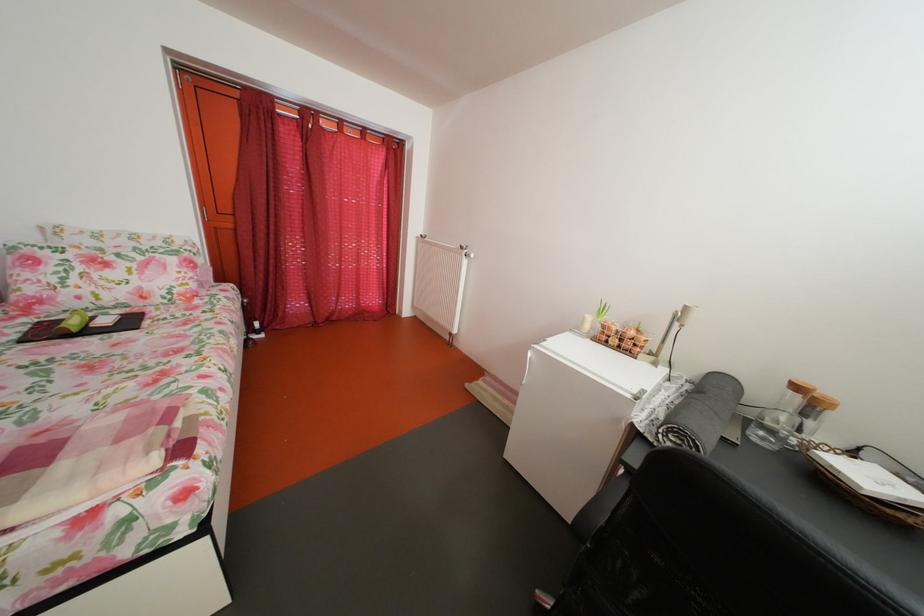
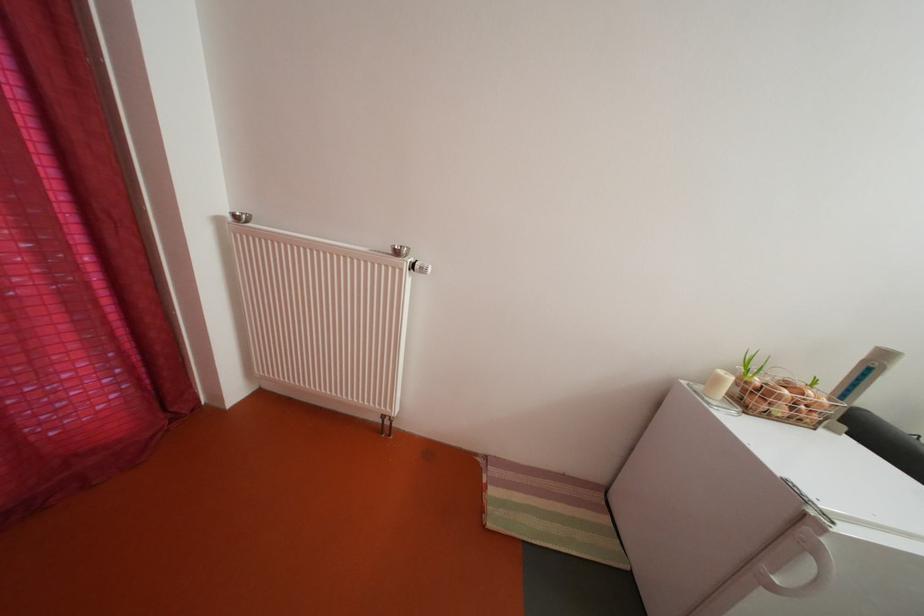
Find the pixel in the second image that matches pixel 626 347 in the first image.

(792, 416)